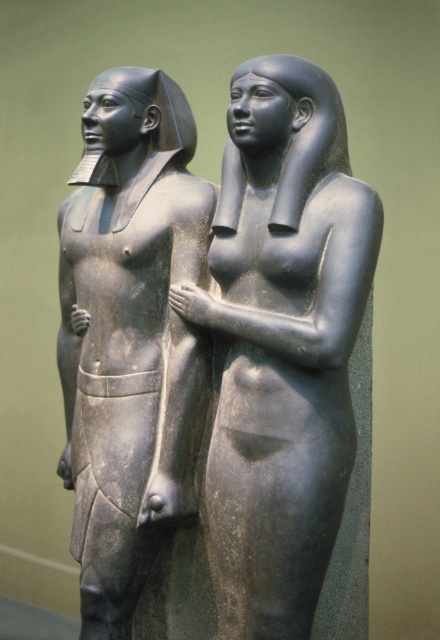
In the scene shown: Can you confirm if matte black statue at center is shorter than matte black statue at left?

Yes, matte black statue at center is shorter than matte black statue at left.

Can you confirm if matte black statue at center is taller than matte black statue at left?

In fact, matte black statue at center may be shorter than matte black statue at left.

The height and width of the screenshot is (640, 440). In order to click on matte black statue at center in this screenshot , I will do `click(282, 342)`.